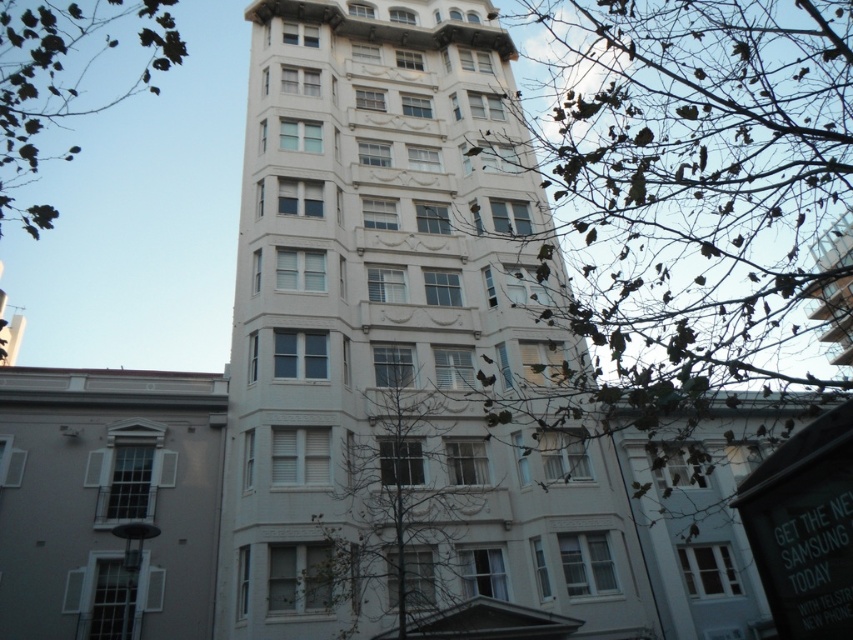
In the scene shown: You are standing in front of the white smooth building at center. Based on the coordinates provided, can you determine if the building is positioned centrally within the image?

The white smooth building at center is located at coordinates point (383,330), which is very close to the center of the image, so it can be considered centrally positioned.

Based on the photo, you are an architect analyzing the building facade. You notice the green leafless tree at center and the green leafy tree at upper left. Which tree is positioned higher in the image?

The green leafy tree at upper left is positioned higher in the image than the green leafless tree at center.

Based on the scene description, which object takes up more area in the image between the white smooth building at center and the green leafy tree at upper left?

The green leafy tree at upper left occupies more space than the white smooth building at center according to the description.